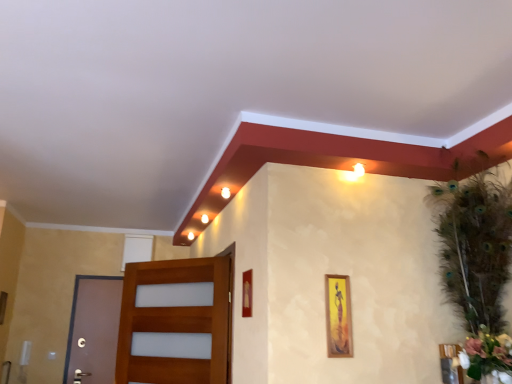
Question: Does matte gold picture frame at center, which is the third picture frame from right to left, have a smaller size compared to brown matte door at left, which is the second door from right to left?

Choices:
 (A) no
 (B) yes

Answer: (B)

Question: Is matte gold picture frame at center, which is the third picture frame from right to left, to the right of brown matte door at left, the second door positioned from the front, from the viewer's perspective?

Choices:
 (A) no
 (B) yes

Answer: (B)

Question: Can you confirm if matte gold picture frame at center, which is the third picture frame from right to left, is thinner than brown matte door at left, the first door when ordered from back to front?

Choices:
 (A) no
 (B) yes

Answer: (B)

Question: Is matte gold picture frame at center, which is the third picture frame from right to left, further to the viewer compared to brown matte door at left, the first door when ordered from back to front?

Choices:
 (A) no
 (B) yes

Answer: (A)

Question: Is matte gold picture frame at center, which appears as the 1th picture frame when viewed from the left, next to brown matte door at left, acting as the 1th door starting from the left?

Choices:
 (A) no
 (B) yes

Answer: (A)

Question: Is point (329, 306) closer or farther from the camera than point (450, 345)?

Choices:
 (A) closer
 (B) farther

Answer: (B)

Question: From a real-world perspective, is wooden picture frame at center-right, the 2th picture frame positioned from the left, positioned above or below wooden picture frame at lower right, the 1th picture frame viewed from the right?

Choices:
 (A) above
 (B) below

Answer: (A)

Question: From the image's perspective, is wooden picture frame at center-right, the 2th picture frame positioned from the left, located above or below wooden picture frame at lower right, positioned as the third picture frame in left-to-right order?

Choices:
 (A) above
 (B) below

Answer: (A)

Question: Based on their sizes in the image, would you say wooden picture frame at center-right, the 2th picture frame positioned from the left, is bigger or smaller than wooden picture frame at lower right, positioned as the third picture frame in left-to-right order?

Choices:
 (A) small
 (B) big

Answer: (A)

Question: From their relative heights in the image, would you say wooden picture frame at lower right, the 1th picture frame viewed from the right, is taller or shorter than wooden door at left, marked as the second door in a left-to-right arrangement?

Choices:
 (A) short
 (B) tall

Answer: (A)

Question: In terms of width, does wooden picture frame at lower right, the 1th picture frame viewed from the right, look wider or thinner when compared to wooden door at left, which appears as the 1th door when viewed from the right?

Choices:
 (A) wide
 (B) thin

Answer: (B)

Question: From the image's perspective, is wooden picture frame at lower right, the 1th picture frame viewed from the right, positioned above or below wooden door at left, arranged as the 2th door when viewed from the back?

Choices:
 (A) below
 (B) above

Answer: (A)

Question: Relative to wooden door at left, arranged as the 2th door when viewed from the back, is wooden picture frame at lower right, the 1th picture frame viewed from the right, in front or behind?

Choices:
 (A) behind
 (B) front

Answer: (B)

Question: Do you think wooden door at left, positioned as the 1th door in front-to-back order, is within wooden picture frame at center-right, the 2th picture frame positioned from the left, or outside of it?

Choices:
 (A) outside
 (B) inside

Answer: (A)

Question: From the image's perspective, is wooden door at left, positioned as the 1th door in front-to-back order, positioned above or below wooden picture frame at center-right, the 2th picture frame positioned from the left?

Choices:
 (A) below
 (B) above

Answer: (A)